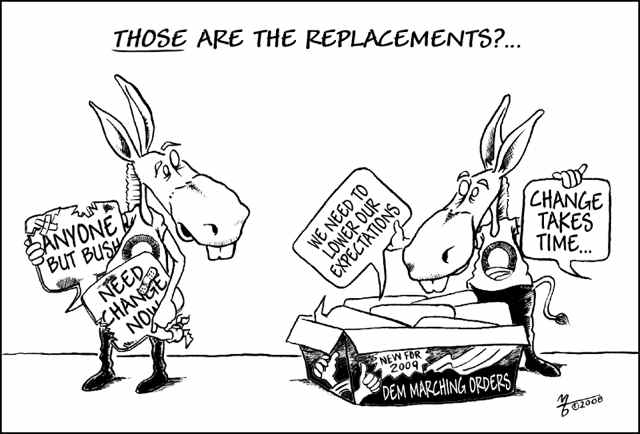
Locate an element on the screen. The height and width of the screenshot is (434, 640). box is located at coordinates (406, 374).